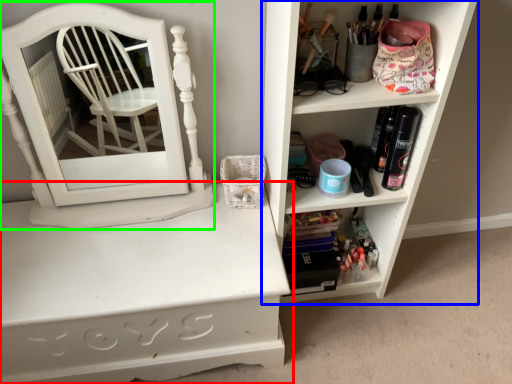
Question: Based on their relative distances, which object is nearer to shelf (highlighted by a red box)? Choose from shelf (highlighted by a blue box) and medicine cabinet (highlighted by a green box).

Choices:
 (A) shelf
 (B) medicine cabinet

Answer: (B)